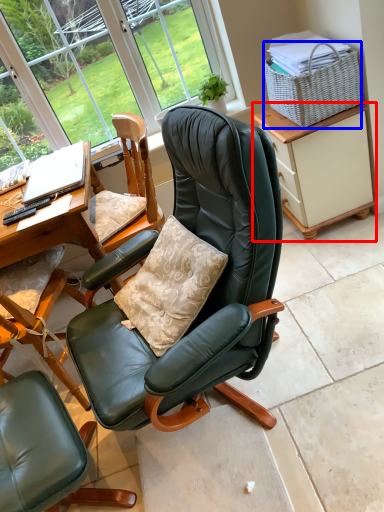
Question: Which of the following is the closest to the observer, cabinetry (highlighted by a red box) or picnic basket (highlighted by a blue box)?

Choices:
 (A) cabinetry
 (B) picnic basket

Answer: (B)